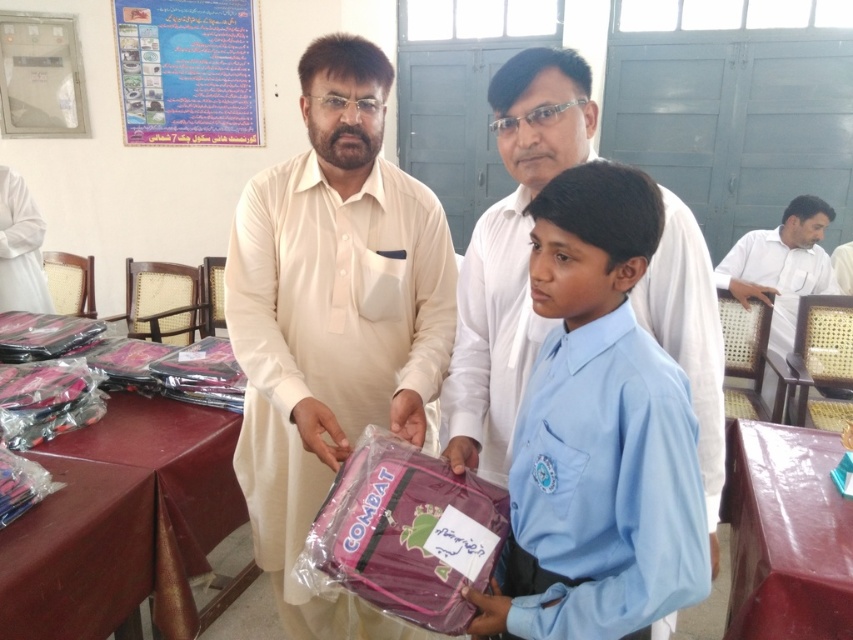
Can you confirm if smooth brown table at lower right is positioned to the right of white matte shirt at right?

In fact, smooth brown table at lower right is to the left of white matte shirt at right.

Between smooth brown table at lower right and white matte shirt at right, which one has less height?

Standing shorter between the two is smooth brown table at lower right.

Who is more distant from viewer, (x=753, y=628) or (x=786, y=241)?

The point (x=786, y=241) is behind.

At what (x,y) coordinates should I click in order to perform the action: click on smooth brown table at lower right. Please return your answer as a coordinate pair (x, y). The height and width of the screenshot is (640, 853). Looking at the image, I should click on (785, 534).

Does point (184, 424) lie in front of point (444, 536)?

No, it is not.

Looking at this image, how distant is wooden table at lower left from purple fabric backpack at center?

wooden table at lower left is 28.15 inches from purple fabric backpack at center.

Where is `wooden table at lower left`? The width and height of the screenshot is (853, 640). wooden table at lower left is located at coordinates (125, 524).

Who is more distant from viewer, (318, 611) or (592, 337)?

Point (318, 611)

Who is lower down, pink matte backpack at center or light blue cotton shirt at center?

Positioned lower is pink matte backpack at center.

Where is `pink matte backpack at center`? pink matte backpack at center is located at coordinates (332, 320).

This screenshot has width=853, height=640. Identify the location of pink matte backpack at center. (332, 320).